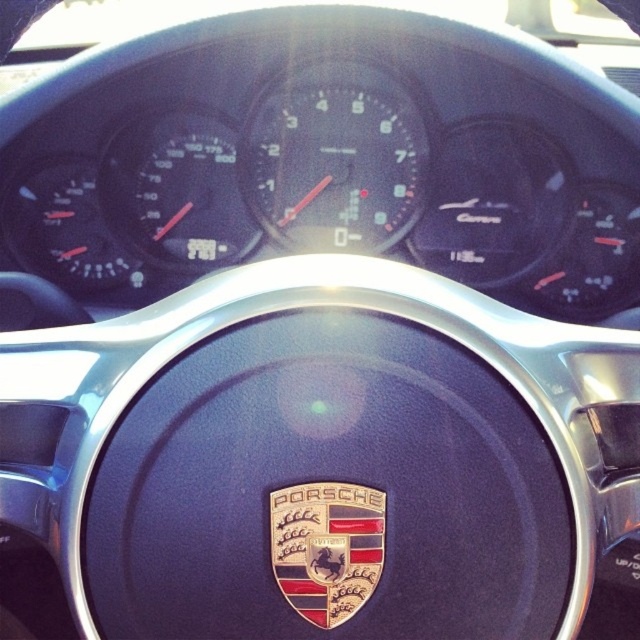
You are a car mechanic inspecting the Porsche dashboard. You see the point at coordinates (333, 157). What object is located at that point?

The point at coordinates (333, 157) indicates the matte black speedometer at center.